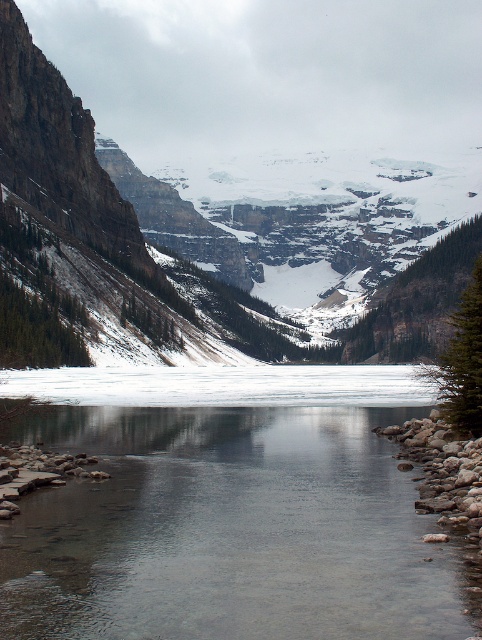
Identify the location of rocky cliff at center. coord(291,144).

Between rocky cliff at center and clear glass river at center, which one appears on the right side from the viewer's perspective?

From the viewer's perspective, rocky cliff at center appears more on the right side.

Does point (295, 236) lie in front of point (147, 625)?

No.

The height and width of the screenshot is (640, 482). I want to click on rocky cliff at center, so click(291, 144).